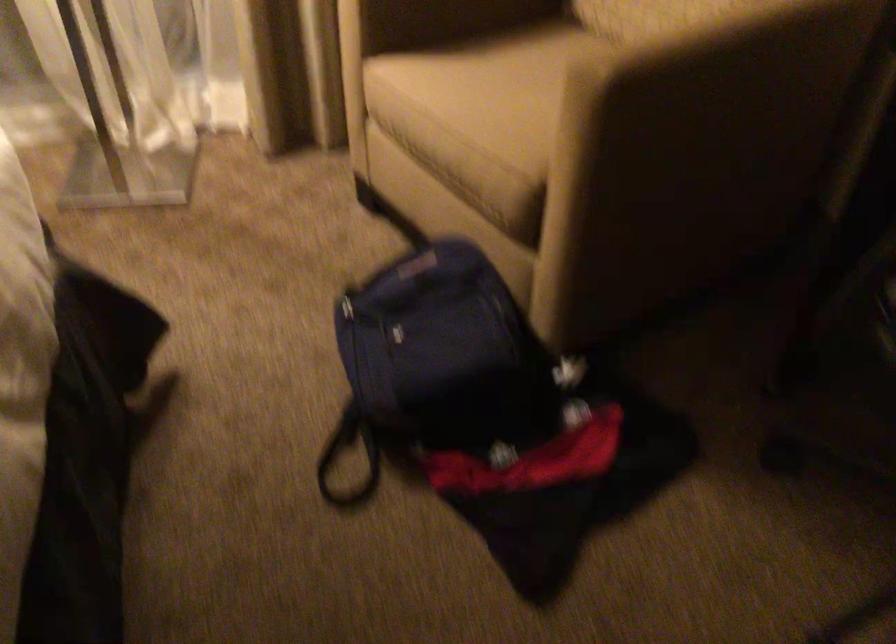
Image resolution: width=896 pixels, height=644 pixels. I want to click on beige chair armrest, so click(x=617, y=53).